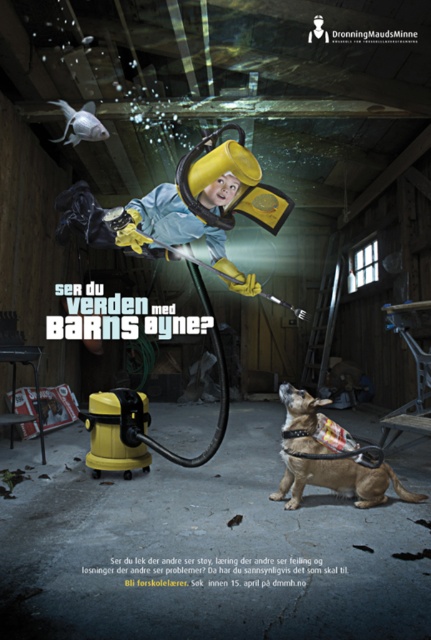
Describe the element at coordinates (340, 481) in the screenshot. The height and width of the screenshot is (640, 431). I see `brown leather dog at lower right` at that location.

Is brown leather dog at lower right bigger than metallic silver sign at lower left?

Yes.

Identify the location of brown leather dog at lower right. The image size is (431, 640). (340, 481).